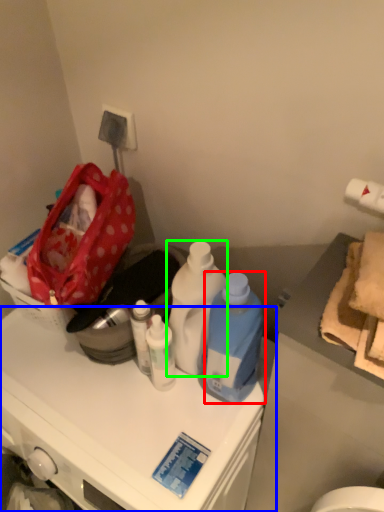
Question: Which object is the closest to the bottle (highlighted by a red box)? Choose among these: cabinetry (highlighted by a blue box) or bottle (highlighted by a green box).

Choices:
 (A) cabinetry
 (B) bottle

Answer: (B)